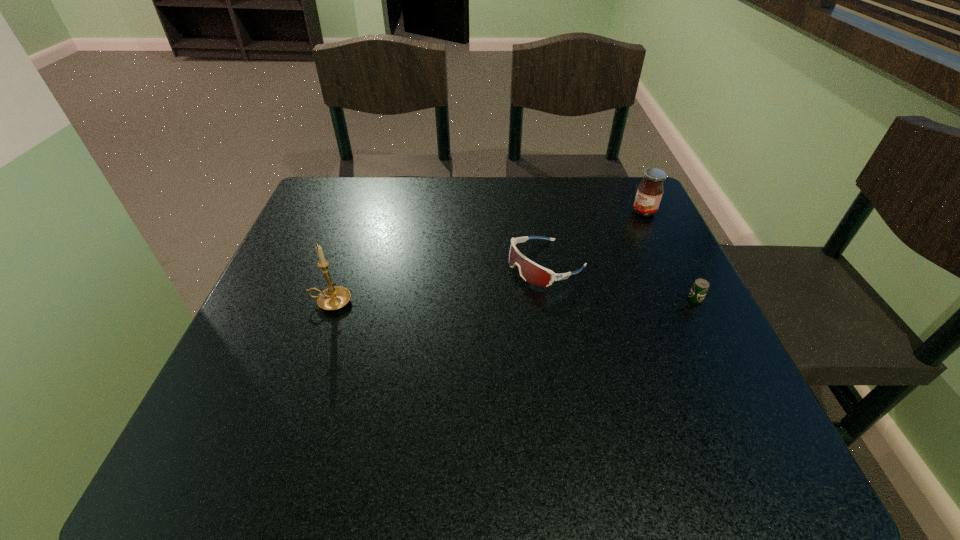
You are a GUI agent. You are given a task and a screenshot of the screen. Output one action in this format:
    pyautogui.click(x=<x>, y=<y>)
    Task: Click on the free space between the shortest object and the second object from left to right
    This screenshot has width=960, height=540.
    Given the screenshot: What is the action you would take?
    tap(621, 281)

Identify the location of vacant point located between the leftmost object and the jam. This screenshot has width=960, height=540. (488, 257).

This screenshot has height=540, width=960. I want to click on vacant point located between the shortest object and the second object from left to right, so click(621, 281).

I want to click on free space that is in between the beer can and the second shortest object, so click(x=621, y=281).

The height and width of the screenshot is (540, 960). Find the location of `free area in between the goggles and the farthest object`. free area in between the goggles and the farthest object is located at coordinates (595, 238).

Locate an element on the screen. Image resolution: width=960 pixels, height=540 pixels. empty location between the beer can and the leftmost object is located at coordinates (513, 301).

The width and height of the screenshot is (960, 540). In order to click on free space between the jam and the beer can in this screenshot , I will do `click(670, 255)`.

The image size is (960, 540). In order to click on object that can be found as the second closest to the jam in this screenshot , I will do `click(700, 287)`.

Select which object is the third closest to the candle holder. Please provide its 2D coordinates. Your answer should be formatted as a tuple, i.e. [(x, y)], where the tuple contains the x and y coordinates of a point satisfying the conditions above.

[(649, 193)]

Where is `vacant space that satisfies the following two spatial constraints: 1. on the front side of the shortest object; 2. on the right side of the goggles`? The height and width of the screenshot is (540, 960). vacant space that satisfies the following two spatial constraints: 1. on the front side of the shortest object; 2. on the right side of the goggles is located at coordinates (553, 299).